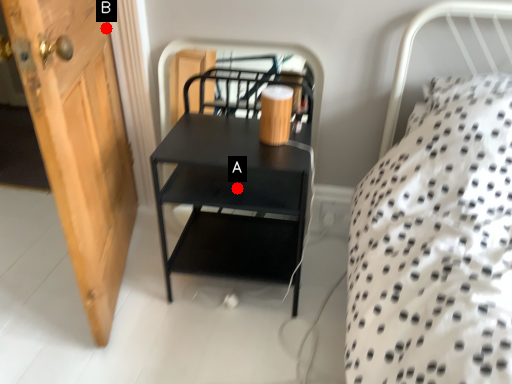
Question: Two points are circled on the image, labeled by A and B beside each circle. Which point is further to the camera?

Choices:
 (A) A is further
 (B) B is further

Answer: (B)